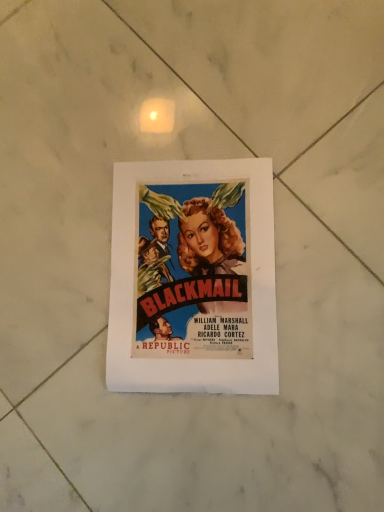
Find the location of a particular element. This screenshot has width=384, height=512. matte paper poster at center is located at coordinates (193, 278).

This screenshot has width=384, height=512. Describe the element at coordinates (193, 278) in the screenshot. I see `matte paper poster at center` at that location.

What is the approximate height of matte paper poster at center?

The height of matte paper poster at center is 0.39 inches.

Where is `matte paper poster at center`? This screenshot has height=512, width=384. matte paper poster at center is located at coordinates (193, 278).